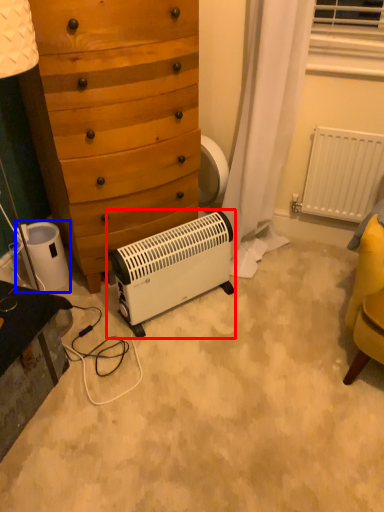
Question: Which object is closer to the camera taking this photo, home appliance (highlighted by a red box) or appliance (highlighted by a blue box)?

Choices:
 (A) home appliance
 (B) appliance

Answer: (A)